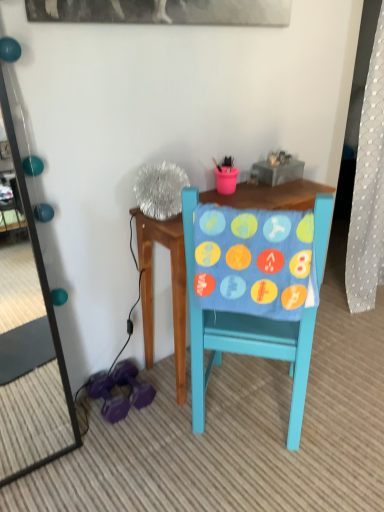
Locate an element on the screen. The height and width of the screenshot is (512, 384). teal glossy mirror at left is located at coordinates (34, 369).

Is teal glossy mirror at left surrounded by blue fabric with colorful patches at center?

No, teal glossy mirror at left is not surrounded by blue fabric with colorful patches at center.

You are a GUI agent. You are given a task and a screenshot of the screen. Output one action in this format:
    pyautogui.click(x=<x>, y=<y>)
    Task: Click on the blanket below the teal glossy mirror at left (from the image's perspective)
    The width and height of the screenshot is (384, 512).
    Given the screenshot: What is the action you would take?
    pyautogui.click(x=254, y=261)

Is the position of blue fabric with colorful patches at center less distant than that of teal glossy mirror at left?

No, it is behind teal glossy mirror at left.

From the image's perspective, who appears lower, blue fabric with colorful patches at center or teal glossy mirror at left?

blue fabric with colorful patches at center, from the image's perspective.

Is matte blue chair at center not close to teal glossy mirror at left?

No, there isn't a large distance between matte blue chair at center and teal glossy mirror at left.

Relative to teal glossy mirror at left, is matte blue chair at center in front or behind?

matte blue chair at center is positioned farther from the viewer than teal glossy mirror at left.

Is matte blue chair at center positioned with its back to teal glossy mirror at left?

No, matte blue chair at center is not facing the opposite direction of teal glossy mirror at left.

From a real-world perspective, relative to teal glossy mirror at left, is matte blue chair at center vertically above or below?

matte blue chair at center is below teal glossy mirror at left.

Who is taller, teal glossy mirror at left or matte blue chair at center?

With more height is matte blue chair at center.

Does teal glossy mirror at left have a smaller size compared to matte blue chair at center?

Indeed, teal glossy mirror at left has a smaller size compared to matte blue chair at center.

Is point (301, 288) more distant than point (291, 373)?

No.

Is blue fabric with colorful patches at center outside of matte blue chair at center?

No, blue fabric with colorful patches at center is not entirely external to matte blue chair at center.

Which object is closer to the camera, blue fabric with colorful patches at center or matte blue chair at center?

blue fabric with colorful patches at center is in front.

Does blue fabric with colorful patches at center have a lesser height compared to matte blue chair at center?

Correct, blue fabric with colorful patches at center is not as tall as matte blue chair at center.

How different are the orientations of teal glossy mirror at left and blue fabric with colorful patches at center in degrees?

The facing directions of teal glossy mirror at left and blue fabric with colorful patches at center are 129 degrees apart.

From the image's perspective, which is below, teal glossy mirror at left or blue fabric with colorful patches at center?

blue fabric with colorful patches at center is shown below in the image.

Is blue fabric with colorful patches at center a part of teal glossy mirror at left?

That's incorrect, blue fabric with colorful patches at center is not inside teal glossy mirror at left.

Locate an element on the screen. The image size is (384, 512). blanket that is behind the teal glossy mirror at left is located at coordinates (254, 261).

Does matte blue chair at center turn towards blue fabric with colorful patches at center?

No.

Can you confirm if matte blue chair at center is shorter than blue fabric with colorful patches at center?

No, matte blue chair at center is not shorter than blue fabric with colorful patches at center.

Is matte blue chair at center at the right side of blue fabric with colorful patches at center?

Indeed, matte blue chair at center is positioned on the right side of blue fabric with colorful patches at center.

Is matte blue chair at center not inside blue fabric with colorful patches at center?

Indeed, matte blue chair at center is completely outside blue fabric with colorful patches at center.

Where is `mirror on the left of blue fabric with colorful patches at center`? mirror on the left of blue fabric with colorful patches at center is located at coordinates (34, 369).

Where is `chair that appears on the right of teal glossy mirror at left`? chair that appears on the right of teal glossy mirror at left is located at coordinates (243, 340).

From the image, which object appears to be farther from blue fabric with colorful patches at center, teal glossy mirror at left or matte blue chair at center?

teal glossy mirror at left is further to blue fabric with colorful patches at center.

Based on their spatial positions, is blue fabric with colorful patches at center or teal glossy mirror at left further from matte blue chair at center?

teal glossy mirror at left.

Considering their positions, is matte blue chair at center positioned closer to teal glossy mirror at left than blue fabric with colorful patches at center?

matte blue chair at center.

Estimate the real-world distances between objects in this image. Which object is further from teal glossy mirror at left, blue fabric with colorful patches at center or matte blue chair at center?

blue fabric with colorful patches at center is further to teal glossy mirror at left.

From the image, which object appears to be nearer to blue fabric with colorful patches at center, matte blue chair at center or teal glossy mirror at left?

matte blue chair at center is closer to blue fabric with colorful patches at center.

Estimate the real-world distances between objects in this image. Which object is closer to matte blue chair at center, teal glossy mirror at left or blue fabric with colorful patches at center?

blue fabric with colorful patches at center lies closer to matte blue chair at center than the other object.

This screenshot has width=384, height=512. Identify the location of blanket between teal glossy mirror at left and matte blue chair at center from left to right. (254, 261).